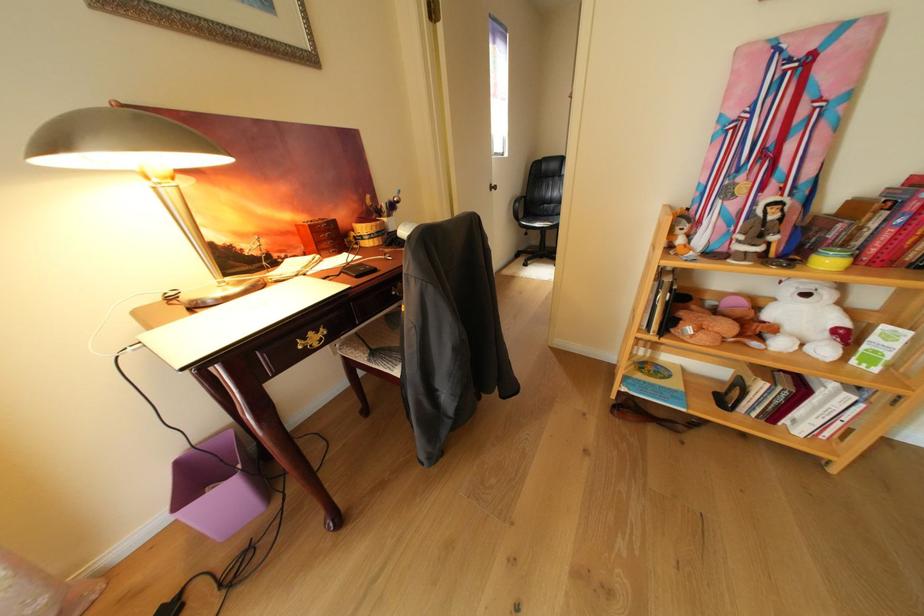
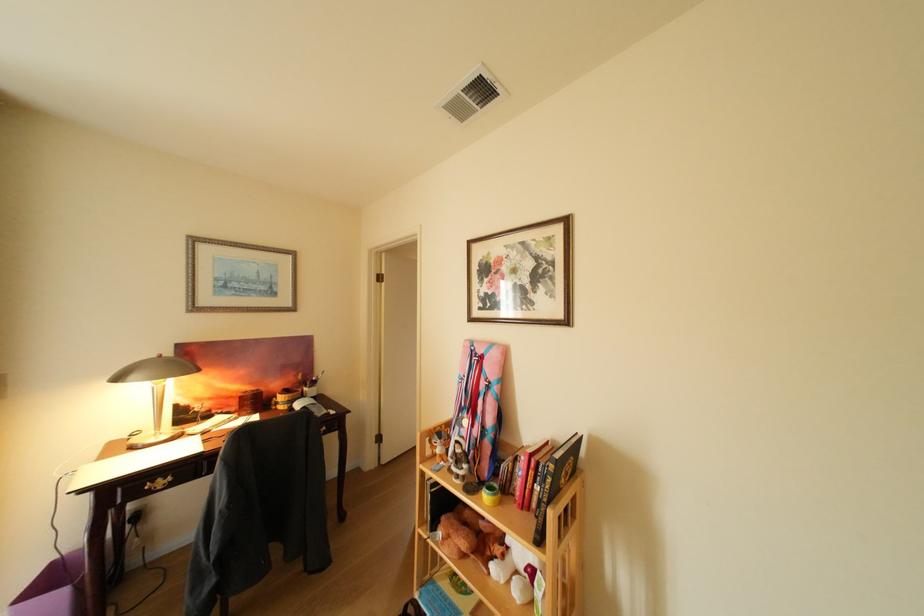
In the second image, find the point that corresponds to point (873, 231) in the first image.

(525, 475)